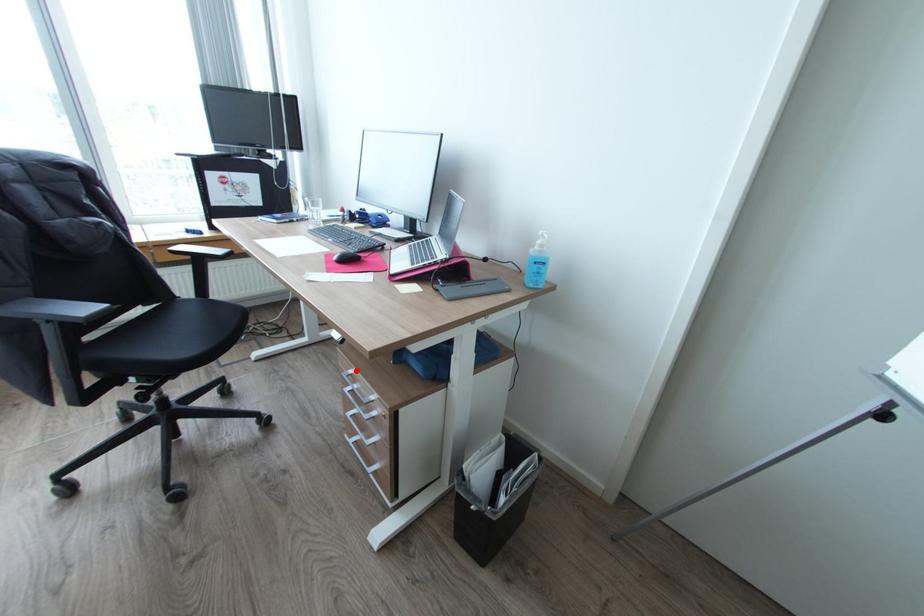
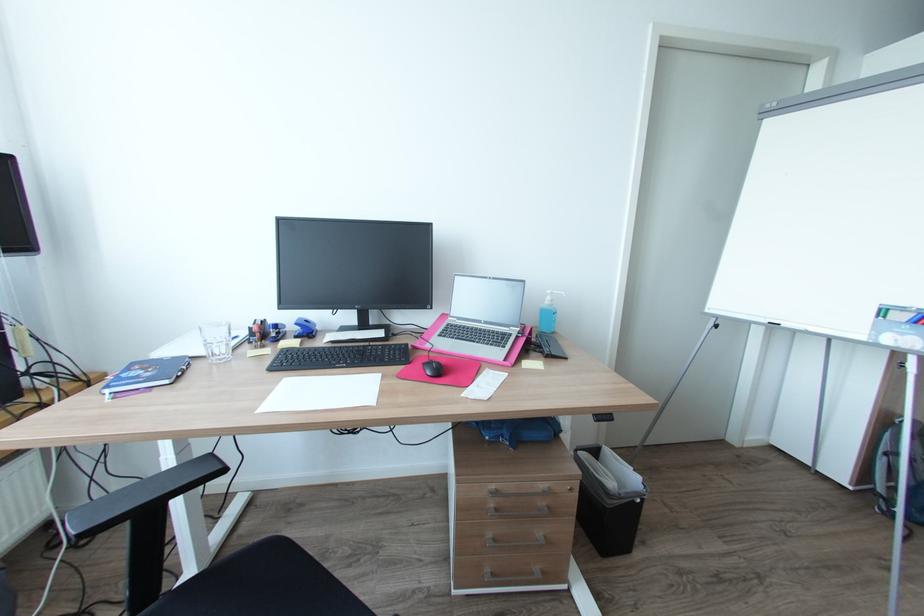
In the second image, find the point that corresponds to the highlighted location in the first image.

(497, 487)